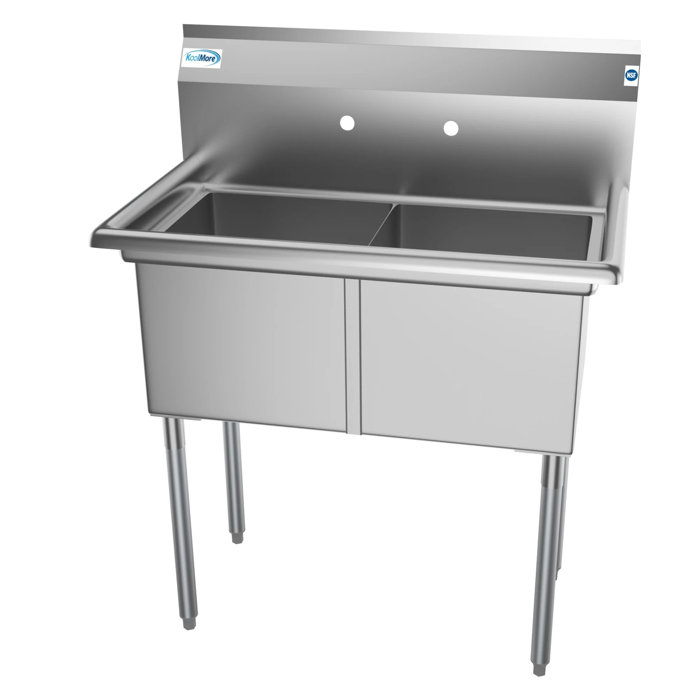
Find the location of `basin`. basin is located at coordinates (507, 230).